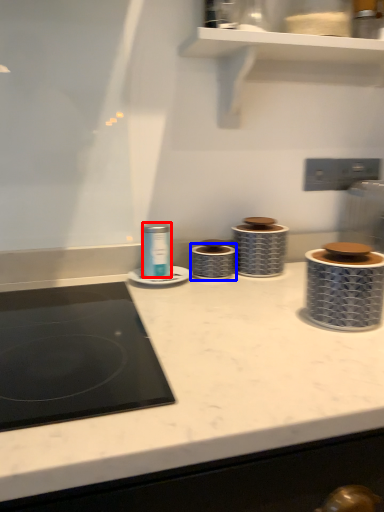
Question: Which point is closer to the camera, appliance (highlighted by a red box) or appliance (highlighted by a blue box)?

Choices:
 (A) appliance
 (B) appliance

Answer: (A)